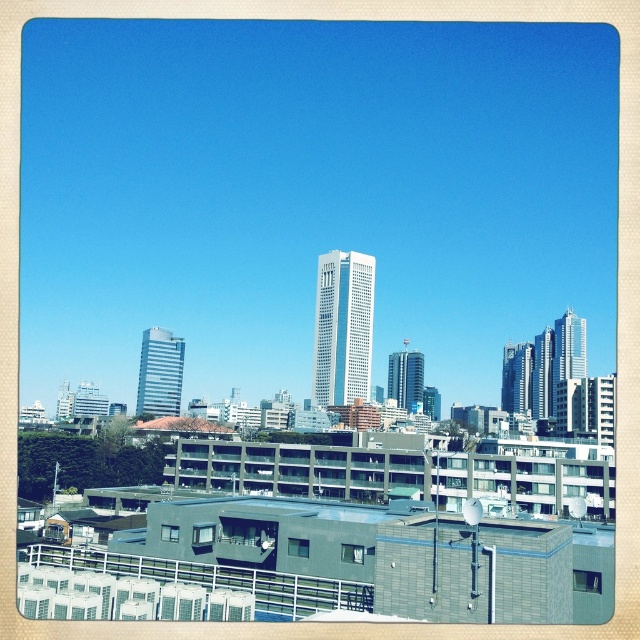
Question: Does gray concrete building at center come in front of sleek glass skyscraper at center?

Choices:
 (A) no
 (B) yes

Answer: (B)

Question: Estimate the real-world distances between objects in this image. Which object is closer to the sleek glass skyscraper at upper right?

Choices:
 (A) light gray glass skyscraper at center-left
 (B) sleek glass skyscraper at center

Answer: (B)

Question: Which object appears closest to the camera in this image?

Choices:
 (A) sleek glass skyscraper at upper right
 (B) sleek glass skyscraper at center
 (C) light gray glass skyscraper at center-left
 (D) gray concrete building at center

Answer: (C)

Question: Does light gray glass skyscraper at center-left appear on the right side of sleek glass skyscraper at center?

Choices:
 (A) yes
 (B) no

Answer: (B)

Question: Which object appears closest to the camera in this image?

Choices:
 (A) sleek glass skyscraper at center
 (B) gray concrete building at center
 (C) sleek glass skyscraper at upper right
 (D) white glass skyscraper at center

Answer: (D)

Question: Is light gray glass skyscraper at center-left closer to camera compared to gray concrete building at center?

Choices:
 (A) no
 (B) yes

Answer: (B)